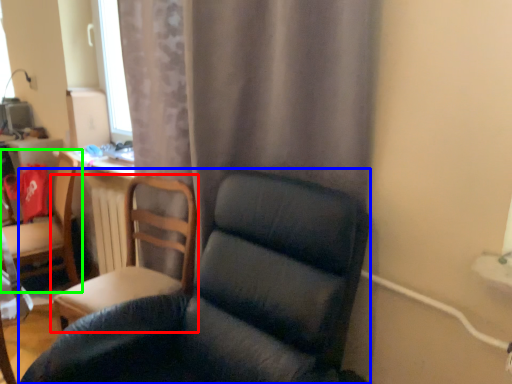
Question: Based on their relative distances, which object is nearer to chair (highlighted by a red box)? Choose from chair (highlighted by a blue box) and chair (highlighted by a green box).

Choices:
 (A) chair
 (B) chair

Answer: (A)